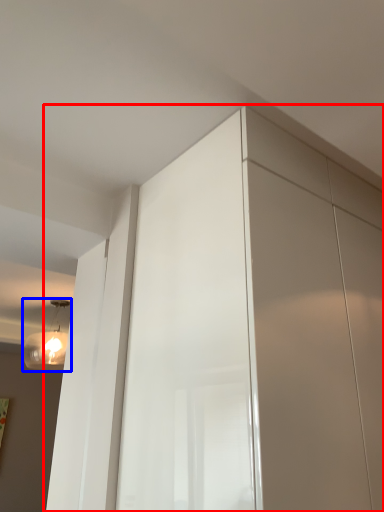
Question: Which of the following is the closest to the observer, dresser (highlighted by a red box) or light fixture (highlighted by a blue box)?

Choices:
 (A) dresser
 (B) light fixture

Answer: (A)